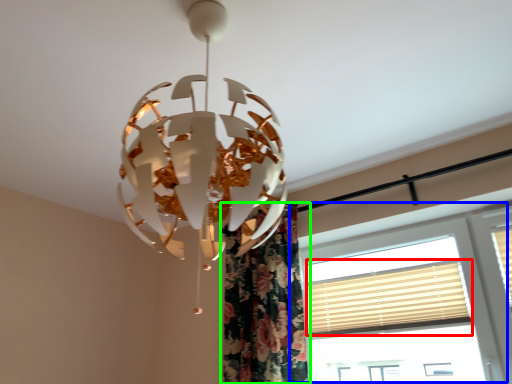
Question: Which object is positioned closest to blind (highlighted by a red box)? Select from window (highlighted by a blue box) and curtain (highlighted by a green box).

Choices:
 (A) window
 (B) curtain

Answer: (A)